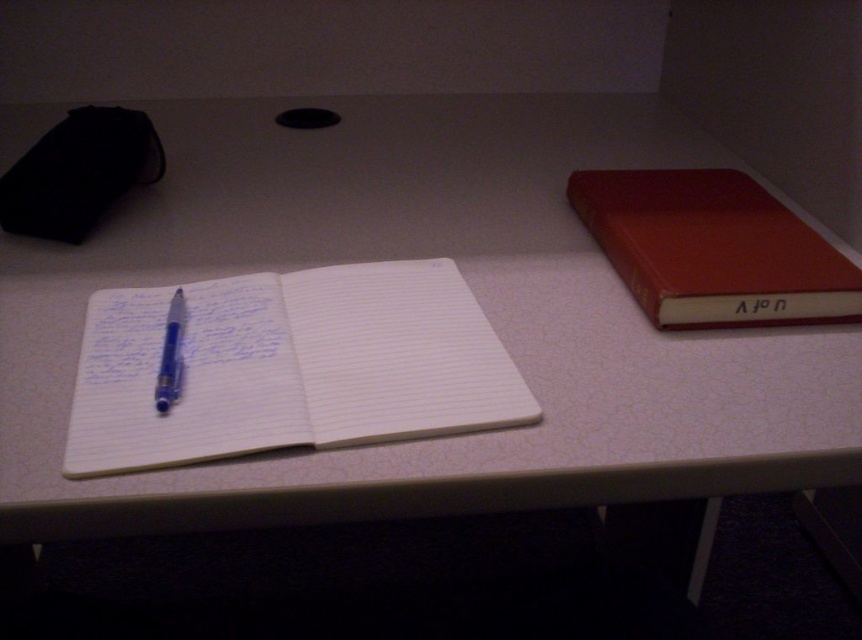
Question: Does white lined paper at center have a lesser width compared to red leather book at right?

Choices:
 (A) no
 (B) yes

Answer: (A)

Question: Which point appears closest to the camera in this image?

Choices:
 (A) (172, 372)
 (B) (380, 426)

Answer: (B)

Question: Can you confirm if red leather book at right is smaller than blue glossy pen at center?

Choices:
 (A) yes
 (B) no

Answer: (B)

Question: Which point is closer to the camera?

Choices:
 (A) (295, 403)
 (B) (170, 378)

Answer: (A)

Question: Does red leather book at right have a greater width compared to blue glossy pen at center?

Choices:
 (A) yes
 (B) no

Answer: (A)

Question: Which of the following is the closest to the observer?

Choices:
 (A) (353, 387)
 (B) (664, 172)
 (C) (180, 307)

Answer: (A)